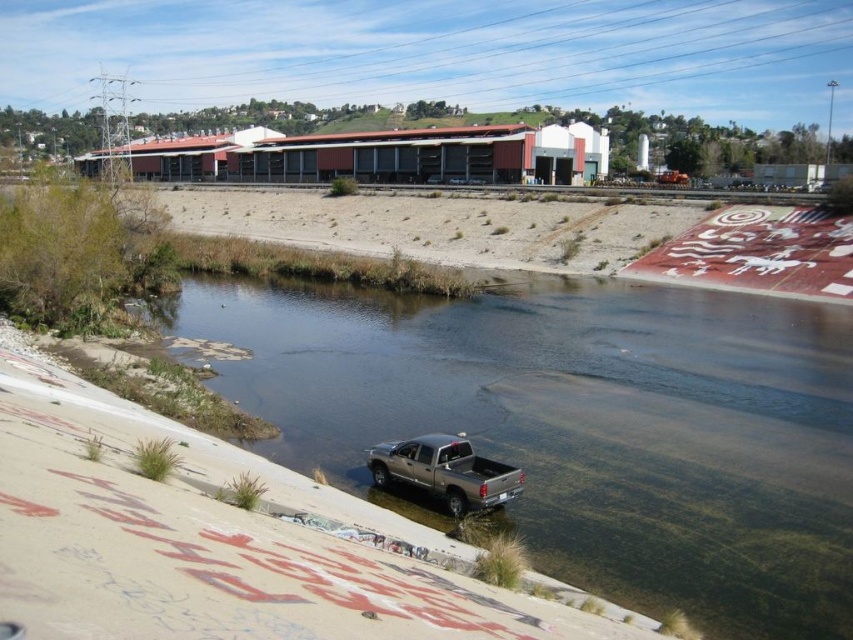
You are a rescue worker trying to reach the silver metallic truck at lower center. The clear water at center is in your path. Considering the width of the water and the truck, can you safely cross the water to reach the truck?

The clear water at center is wider than the silver metallic truck at lower center, so it is possible to cross the water to reach the truck safely.